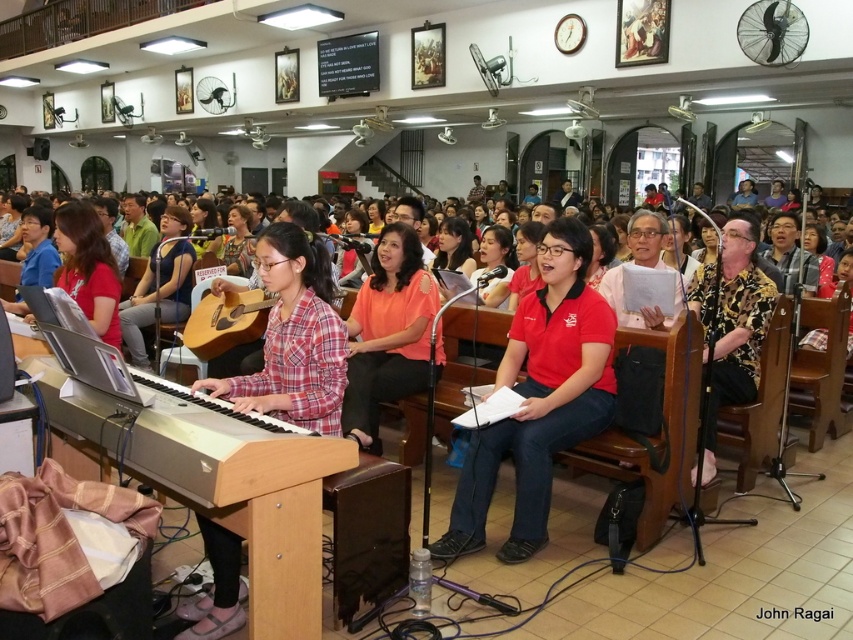
Can you confirm if matte pink shirt at center is positioned above matte black guitar at center?

No, matte pink shirt at center is not above matte black guitar at center.

Between point (500, 260) and point (244, 272), which one is positioned behind?

The point (244, 272) is more distant.

You are a GUI agent. You are given a task and a screenshot of the screen. Output one action in this format:
    pyautogui.click(x=<x>, y=<y>)
    Task: Click on the matte pink shirt at center
    This screenshot has width=853, height=640.
    Given the screenshot: What is the action you would take?
    pyautogui.click(x=495, y=260)

Can you confirm if plaid fabric guitar at center is smaller than matte black guitar at center?

No.

Which of these two, plaid fabric guitar at center or matte black guitar at center, stands shorter?

matte black guitar at center is shorter.

Find the location of a particular element. The height and width of the screenshot is (640, 853). plaid fabric guitar at center is located at coordinates (160, 284).

Does point (236, 472) come farther from viewer compared to point (349, 394)?

No, it is not.

Is wooden piano at lower left behind orange matte shirt at center?

No, wooden piano at lower left is closer to the viewer.

Does point (184, 476) come farther from viewer compared to point (418, 364)?

That is False.

You are a GUI agent. You are given a task and a screenshot of the screen. Output one action in this format:
    pyautogui.click(x=<x>, y=<y>)
    Task: Click on the wooden piano at lower left
    
    Given the screenshot: What is the action you would take?
    pyautogui.click(x=184, y=440)